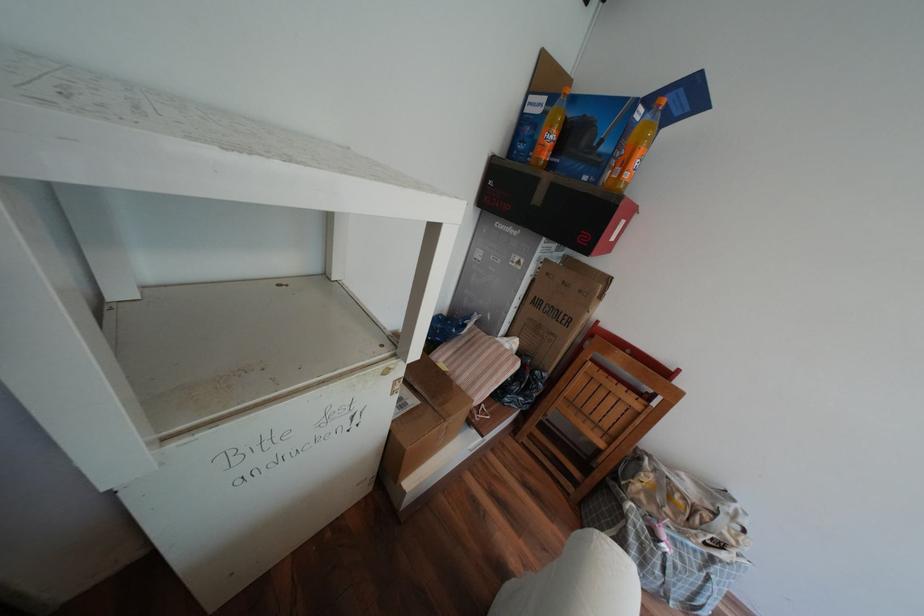
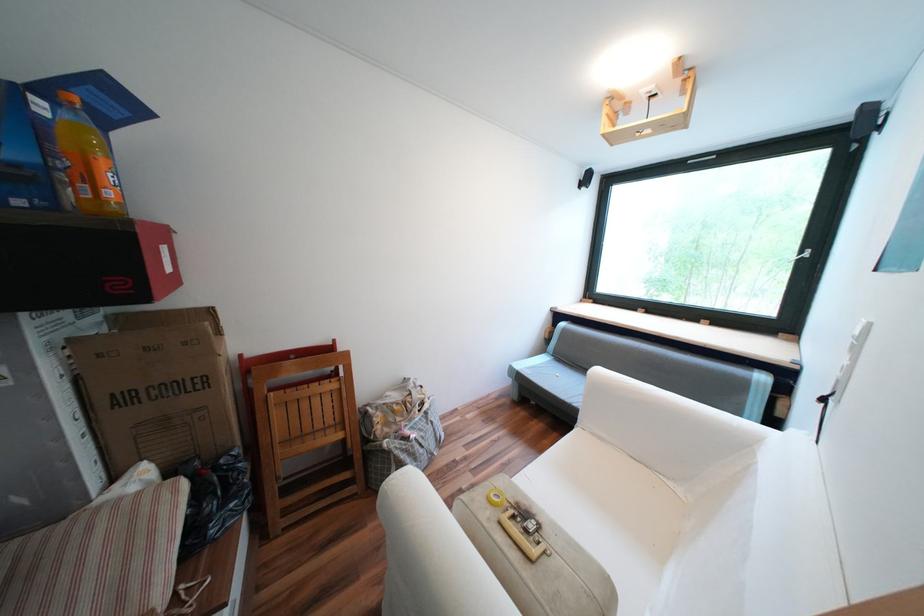
The point at [553,549] is marked in the first image. Where is the corresponding point in the second image?

(387, 548)